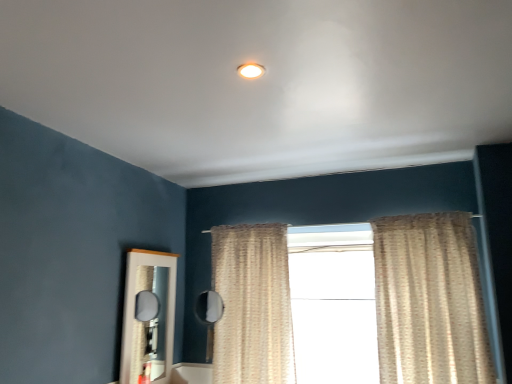
Question: Is the depth of white sheer curtains at center less than that of beige textured curtain at center, arranged as the first curtain when viewed from the left?

Choices:
 (A) yes
 (B) no

Answer: (B)

Question: Is white sheer curtains at center at the right side of beige textured curtain at center, arranged as the first curtain when viewed from the left?

Choices:
 (A) no
 (B) yes

Answer: (B)

Question: Considering the relative sizes of white sheer curtains at center and beige textured curtain at center, which appears as the 2th curtain when viewed from the right, in the image provided, is white sheer curtains at center wider than beige textured curtain at center, which appears as the 2th curtain when viewed from the right,?

Choices:
 (A) no
 (B) yes

Answer: (A)

Question: Can you confirm if white sheer curtains at center is shorter than beige textured curtain at center, which appears as the 2th curtain when viewed from the right?

Choices:
 (A) yes
 (B) no

Answer: (B)

Question: Is white sheer curtains at center not close to beige textured curtain at center, arranged as the first curtain when viewed from the left?

Choices:
 (A) no
 (B) yes

Answer: (A)

Question: Considering the relative sizes of white sheer curtains at center and beige textured curtain at center, which appears as the 2th curtain when viewed from the right, in the image provided, is white sheer curtains at center thinner than beige textured curtain at center, which appears as the 2th curtain when viewed from the right,?

Choices:
 (A) no
 (B) yes

Answer: (B)

Question: Is white sheer curtains at center not close to beige textured curtain at right, positioned as the 2th curtain in left-to-right order?

Choices:
 (A) no
 (B) yes

Answer: (A)

Question: Is beige textured curtain at right, positioned as the 2th curtain in left-to-right order, inside white sheer curtains at center?

Choices:
 (A) no
 (B) yes

Answer: (A)

Question: From the image's perspective, is white sheer curtains at center on beige textured curtain at right, positioned as the 2th curtain in left-to-right order?

Choices:
 (A) yes
 (B) no

Answer: (B)

Question: Is white sheer curtains at center next to beige textured curtain at right, which is the 1th curtain from right to left?

Choices:
 (A) no
 (B) yes

Answer: (A)

Question: Does white sheer curtains at center have a greater width compared to beige textured curtain at right, positioned as the 2th curtain in left-to-right order?

Choices:
 (A) no
 (B) yes

Answer: (A)

Question: Is white sheer curtains at center turned away from beige textured curtain at right, which is the 1th curtain from right to left?

Choices:
 (A) yes
 (B) no

Answer: (B)

Question: Can you confirm if white glossy mirror at lower left is positioned to the left of matte white light fixture at upper center?

Choices:
 (A) yes
 (B) no

Answer: (A)